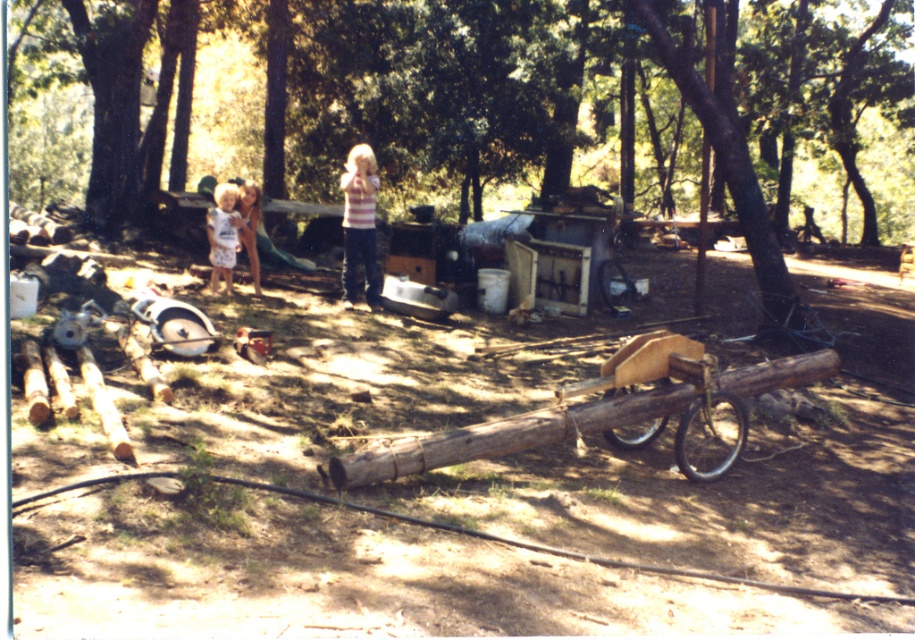
Based on the photo, you are a hiker who has just arrived at the campsite. You see the brown rough log at lower center and the blonde hair at center. Which object is closer to the ground?

The blonde hair at center is closer to the ground because the brown rough log at lower center is located above it.

You are trying to move the wooden cart at center to the other side of the brown rough log at lower center. Can you push the cart through the space underneath the log?

The brown rough log at lower center is larger than the wooden cart at center, so the cart can be pushed through the space underneath the log as long as the cart is smaller than the clearance provided by the log.

You are standing at the point marked by the coordinates point (359, 221) in the image. What object is located exactly at this point?

The point (359, 221) marks the striped shirt at center.